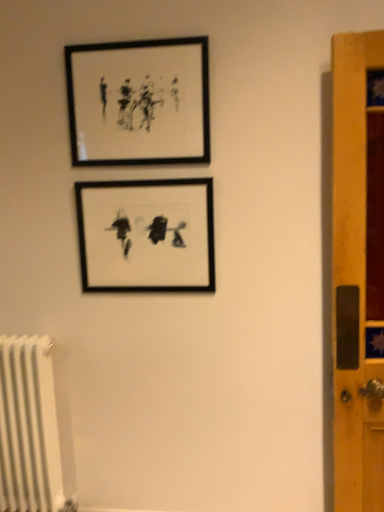
Question: Considering the relative sizes of black matte picture frame at upper center, which is counted as the 2th picture frame, starting from the bottom, and black matte picture frame at center, marked as the 1th picture frame in a bottom-to-top arrangement, in the image provided, is black matte picture frame at upper center, which is counted as the 2th picture frame, starting from the bottom, bigger than black matte picture frame at center, marked as the 1th picture frame in a bottom-to-top arrangement,?

Choices:
 (A) yes
 (B) no

Answer: (A)

Question: Does black matte picture frame at upper center, positioned as the first picture frame in top-to-bottom order, have a greater height compared to black matte picture frame at center, arranged as the 2th picture frame when viewed from the top?

Choices:
 (A) yes
 (B) no

Answer: (B)

Question: Is black matte picture frame at upper center, positioned as the first picture frame in top-to-bottom order, thinner than black matte picture frame at center, marked as the 1th picture frame in a bottom-to-top arrangement?

Choices:
 (A) no
 (B) yes

Answer: (A)

Question: From a real-world perspective, is black matte picture frame at upper center, which is counted as the 2th picture frame, starting from the bottom, beneath black matte picture frame at center, arranged as the 2th picture frame when viewed from the top?

Choices:
 (A) no
 (B) yes

Answer: (A)

Question: Is black matte picture frame at upper center, which is counted as the 2th picture frame, starting from the bottom, outside of black matte picture frame at center, marked as the 1th picture frame in a bottom-to-top arrangement?

Choices:
 (A) yes
 (B) no

Answer: (A)

Question: Is black matte picture frame at upper center, positioned as the first picture frame in top-to-bottom order, oriented towards black matte picture frame at center, arranged as the 2th picture frame when viewed from the top?

Choices:
 (A) no
 (B) yes

Answer: (A)

Question: From the image's perspective, is black matte picture frame at center, arranged as the 2th picture frame when viewed from the top, beneath black matte picture frame at upper center, which is counted as the 2th picture frame, starting from the bottom?

Choices:
 (A) no
 (B) yes

Answer: (B)

Question: From the image's perspective, is black matte picture frame at center, marked as the 1th picture frame in a bottom-to-top arrangement, above black matte picture frame at upper center, which is counted as the 2th picture frame, starting from the bottom?

Choices:
 (A) no
 (B) yes

Answer: (A)

Question: Considering the relative sizes of black matte picture frame at center, marked as the 1th picture frame in a bottom-to-top arrangement, and black matte picture frame at upper center, positioned as the first picture frame in top-to-bottom order, in the image provided, is black matte picture frame at center, marked as the 1th picture frame in a bottom-to-top arrangement, smaller than black matte picture frame at upper center, positioned as the first picture frame in top-to-bottom order,?

Choices:
 (A) no
 (B) yes

Answer: (B)

Question: Is black matte picture frame at center, marked as the 1th picture frame in a bottom-to-top arrangement, facing away from black matte picture frame at upper center, which is counted as the 2th picture frame, starting from the bottom?

Choices:
 (A) yes
 (B) no

Answer: (B)

Question: Considering the relative positions of black matte picture frame at center, arranged as the 2th picture frame when viewed from the top, and black matte picture frame at upper center, positioned as the first picture frame in top-to-bottom order, in the image provided, is black matte picture frame at center, arranged as the 2th picture frame when viewed from the top, to the right of black matte picture frame at upper center, positioned as the first picture frame in top-to-bottom order, from the viewer's perspective?

Choices:
 (A) yes
 (B) no

Answer: (A)

Question: Is black matte picture frame at center, marked as the 1th picture frame in a bottom-to-top arrangement, far away from black matte picture frame at upper center, which is counted as the 2th picture frame, starting from the bottom?

Choices:
 (A) yes
 (B) no

Answer: (B)

Question: From the image's perspective, is black matte picture frame at upper center, positioned as the first picture frame in top-to-bottom order, positioned above or below black matte picture frame at center, arranged as the 2th picture frame when viewed from the top?

Choices:
 (A) below
 (B) above

Answer: (B)